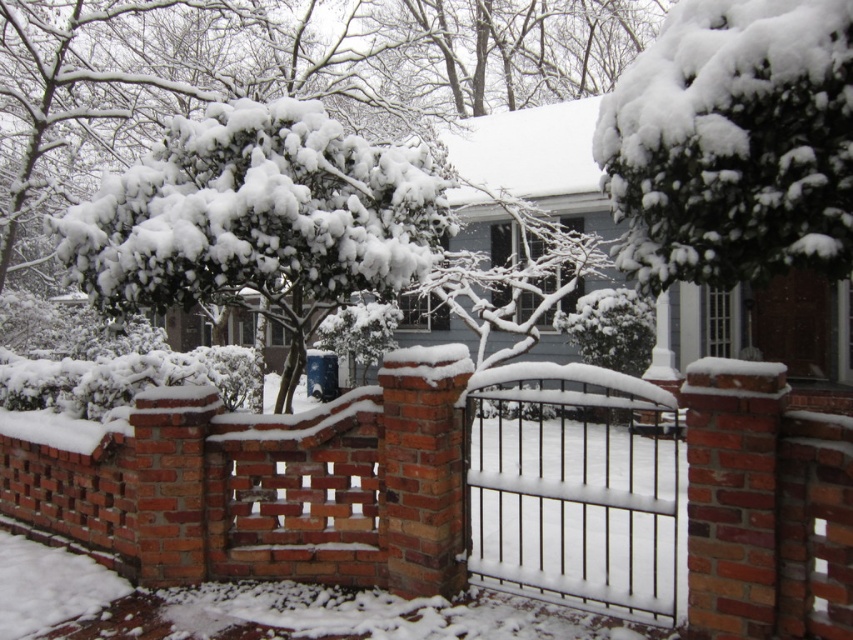
You are a painter who wants to paint the brick wall at center and the black wrought iron gate at center. If you have a limited amount of paint, which object should you prioritize painting first based on their sizes?

The brick wall at center is smaller than the black wrought iron gate at center, so you should prioritize painting the black wrought iron gate at center first because it requires more paint due to its larger size.

You are a delivery person trying to reach the front door of the house. The green textured bush at upper right and the black wrought iron gate at center are in your way. Which object is closer to you, and can you step around it to reach the door?

The green textured bush at upper right is 2.88 meters away from the black wrought iron gate at center. Since the gate is at the center and the bush is further away, you can step around the gate first as it is closer to you.